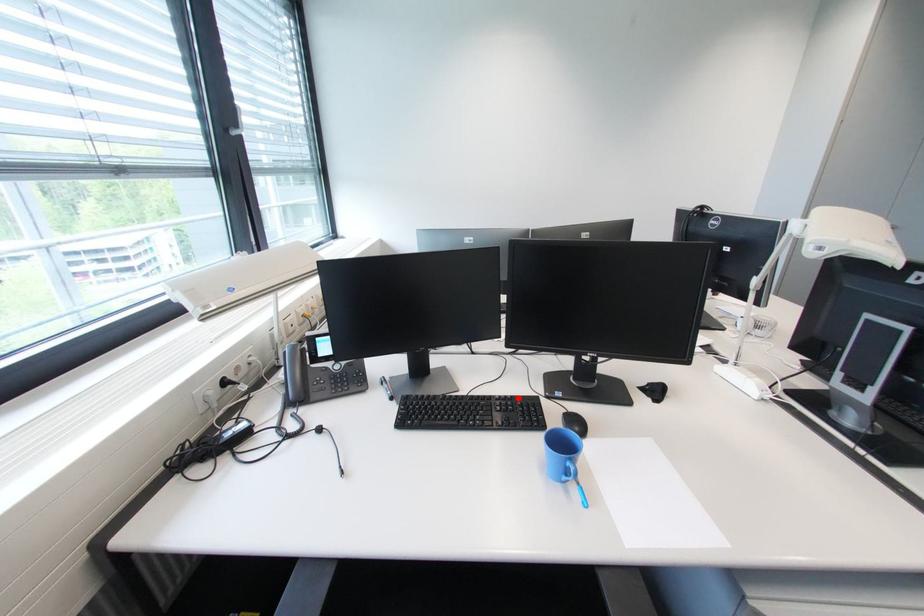
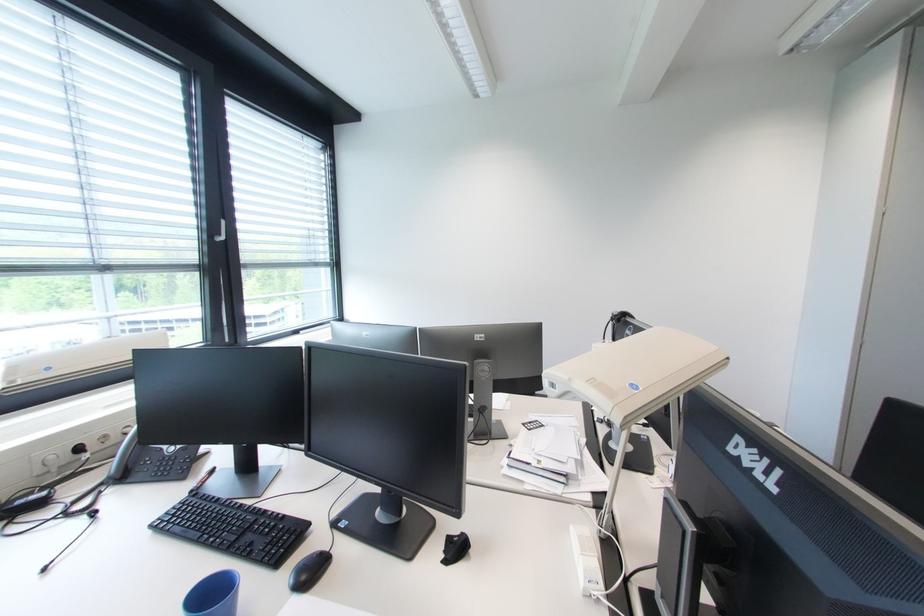
Locate, in the second image, the point that corresponds to the highlighted location in the first image.

(290, 517)